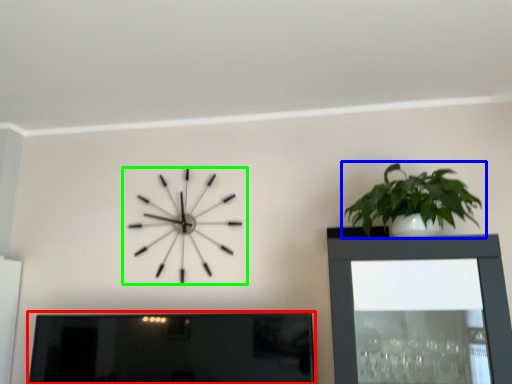
Question: Which object is the closest to the picture frame (highlighted by a red box)? Choose among these: houseplant (highlighted by a blue box) or wall clock (highlighted by a green box).

Choices:
 (A) houseplant
 (B) wall clock

Answer: (B)